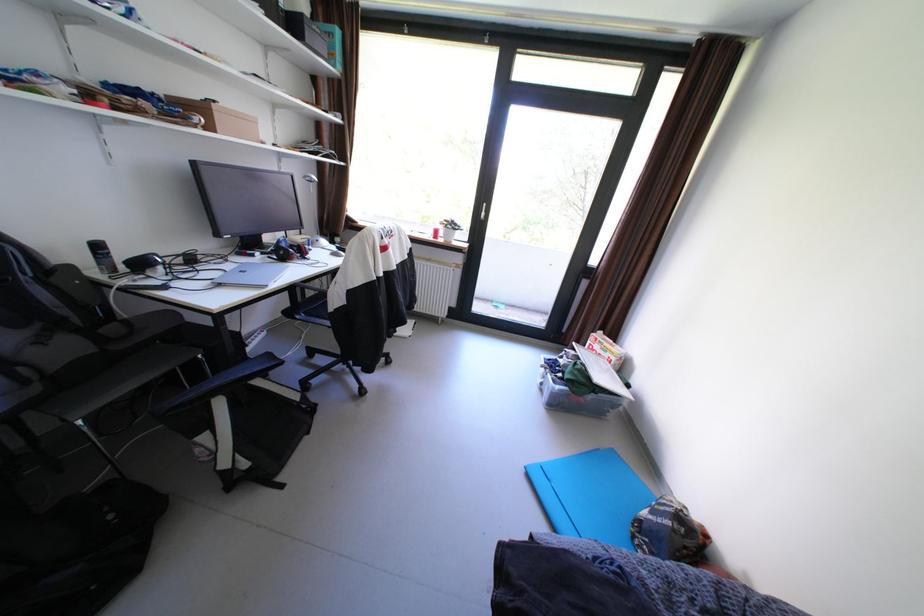
This screenshot has height=616, width=924. In order to click on black spray can in this screenshot , I will do tap(102, 256).